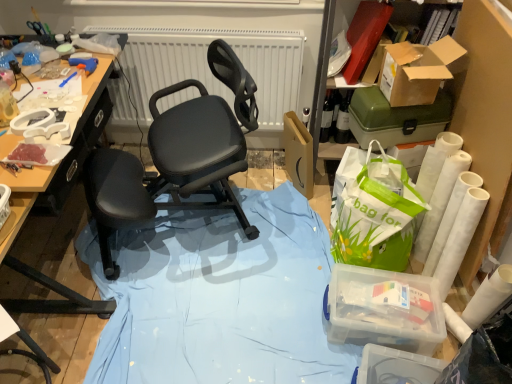
Question: Is cardboard box at upper right, the first box from the top, to the right of white plastic tray at upper left from the viewer's perspective?

Choices:
 (A) no
 (B) yes

Answer: (B)

Question: Does cardboard box at upper right, which is the 4th box from bottom to top, have a lesser height compared to white plastic tray at upper left?

Choices:
 (A) yes
 (B) no

Answer: (B)

Question: Can you confirm if cardboard box at upper right, which is the 4th box from bottom to top, is smaller than white plastic tray at upper left?

Choices:
 (A) yes
 (B) no

Answer: (B)

Question: From the image's perspective, is cardboard box at upper right, which is the 4th box from bottom to top, located beneath white plastic tray at upper left?

Choices:
 (A) no
 (B) yes

Answer: (A)

Question: Would you say white plastic tray at upper left is part of cardboard box at upper right, which is the 4th box from bottom to top,'s contents?

Choices:
 (A) yes
 (B) no

Answer: (B)

Question: Does cardboard box at upper right, the first box from the top, turn towards white plastic tray at upper left?

Choices:
 (A) yes
 (B) no

Answer: (B)

Question: Does matte blue glue gun at upper left touch transparent plastic container at lower right, marked as the 1th box in a bottom-to-top arrangement?

Choices:
 (A) yes
 (B) no

Answer: (B)

Question: Are matte blue glue gun at upper left and transparent plastic container at lower right, marked as the 1th box in a bottom-to-top arrangement, located far from each other?

Choices:
 (A) yes
 (B) no

Answer: (A)

Question: From a real-world perspective, is matte blue glue gun at upper left beneath transparent plastic container at lower right, which appears as the fourth box when viewed from the top?

Choices:
 (A) no
 (B) yes

Answer: (A)

Question: Is matte blue glue gun at upper left to the right of transparent plastic container at lower right, which appears as the fourth box when viewed from the top, from the viewer's perspective?

Choices:
 (A) no
 (B) yes

Answer: (A)

Question: From a real-world perspective, is matte blue glue gun at upper left on top of transparent plastic container at lower right, which appears as the fourth box when viewed from the top?

Choices:
 (A) yes
 (B) no

Answer: (A)

Question: Is matte blue glue gun at upper left oriented away from transparent plastic container at lower right, marked as the 1th box in a bottom-to-top arrangement?

Choices:
 (A) yes
 (B) no

Answer: (B)

Question: From the image's perspective, is green plastic toolbox at upper right, which is the second box in top-to-bottom order, located above transparent plastic container at lower right, marked as the 1th box in a bottom-to-top arrangement?

Choices:
 (A) yes
 (B) no

Answer: (A)